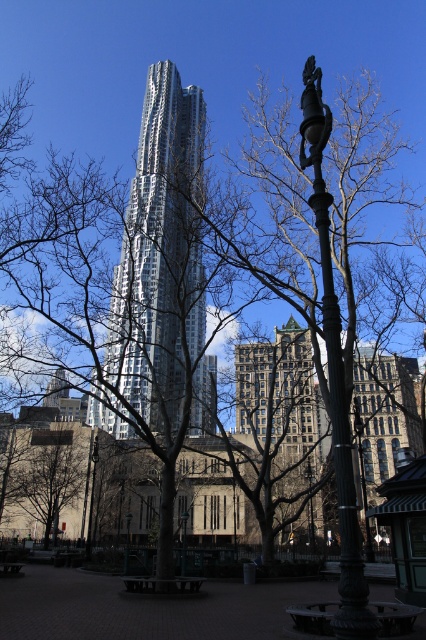
Question: Which object appears closest to the camera in this image?

Choices:
 (A) green patina metal lamp post at right
 (B) polished metal lamp post at center

Answer: (A)

Question: Is polished metal lamp post at center below polished bronze lamp post at center?

Choices:
 (A) yes
 (B) no

Answer: (A)

Question: Which object is positioned closest to the green metallic lamp post at center?

Choices:
 (A) polished metal lamp post at center
 (B) green patina metal lamp post at right

Answer: (A)

Question: Among these objects, which one is farthest from the camera?

Choices:
 (A) green patina metal lamp post at right
 (B) polished bronze lamp post at center

Answer: (B)

Question: Is polished metal lamp post at center above green metallic lamp post at center?

Choices:
 (A) yes
 (B) no

Answer: (A)

Question: Observing the image, what is the correct spatial positioning of shiny silver skyscraper at center in reference to green patina metal lamp post at right?

Choices:
 (A) right
 (B) left

Answer: (B)